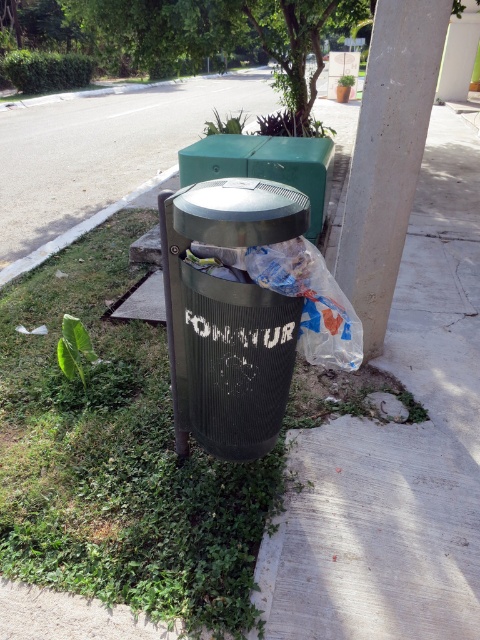
Is green grass at lower left above white concrete pillar at upper right?

Actually, green grass at lower left is below white concrete pillar at upper right.

Where is `green grass at lower left`? green grass at lower left is located at coordinates click(x=118, y=456).